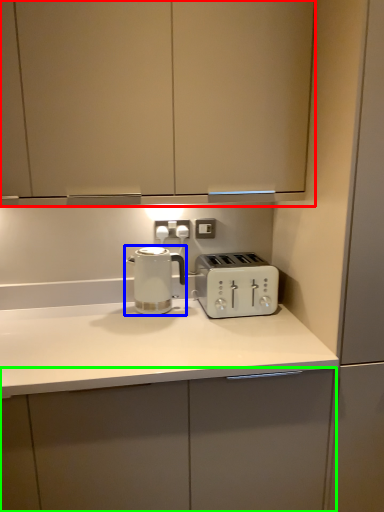
Question: Considering the real-world distances, which object is closest to cabinetry (highlighted by a red box)? kettle (highlighted by a blue box) or cabinetry (highlighted by a green box).

Choices:
 (A) kettle
 (B) cabinetry

Answer: (A)